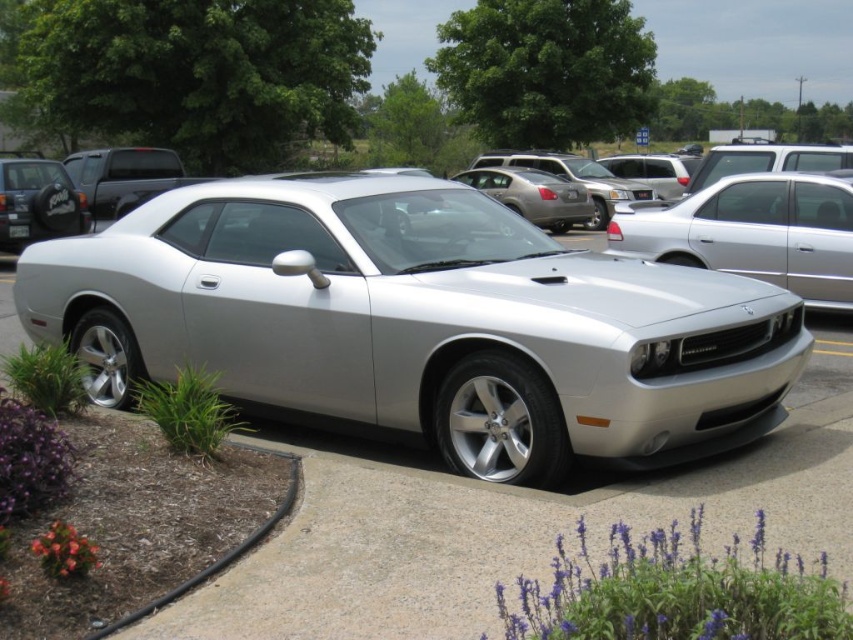
Question: Estimate the real-world distances between objects in this image. Which object is closer to the satin silver car at center?

Choices:
 (A) silver metallic sports car at center
 (B) matte black suv at left
 (C) satin black truck at upper left
 (D) black plastic license plate at center

Answer: (A)

Question: Which object is the closest to the satin black truck at upper left?

Choices:
 (A) matte black suv at left
 (B) black plastic license plate at center

Answer: (A)

Question: Can you confirm if satin silver car at center is bigger than black plastic license plate at center?

Choices:
 (A) no
 (B) yes

Answer: (B)

Question: Does matte black suv at left have a lesser width compared to black plastic license plate at center?

Choices:
 (A) no
 (B) yes

Answer: (A)

Question: Which object appears farthest from the camera in this image?

Choices:
 (A) satin silver car at center
 (B) silver metallic sports car at center
 (C) black plastic license plate at center

Answer: (C)

Question: Does silver metallic sports car at center have a larger size compared to matte black suv at left?

Choices:
 (A) yes
 (B) no

Answer: (A)